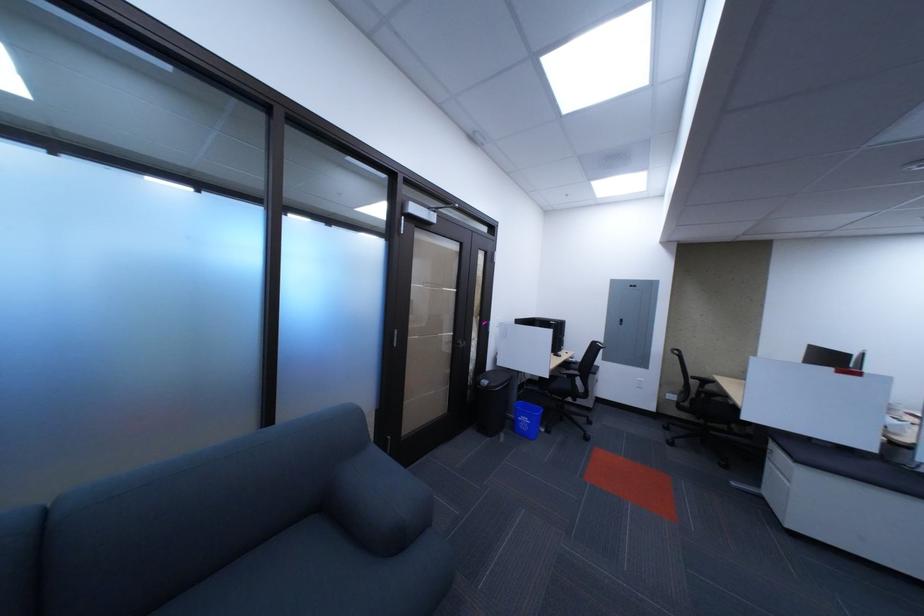
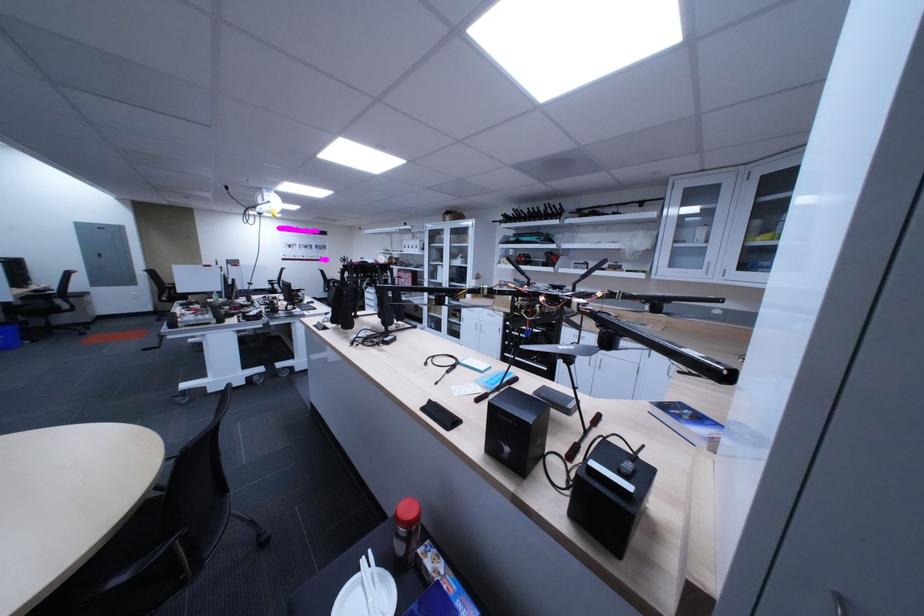
In the second image, find the point that corresponds to the point at 540,421 in the first image.

(9, 339)